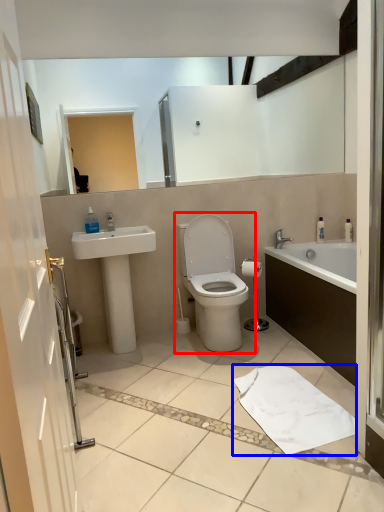
Question: Which object appears closest to the camera in this image, toilet (highlighted by a red box) or bath towel (highlighted by a blue box)?

Choices:
 (A) toilet
 (B) bath towel

Answer: (B)